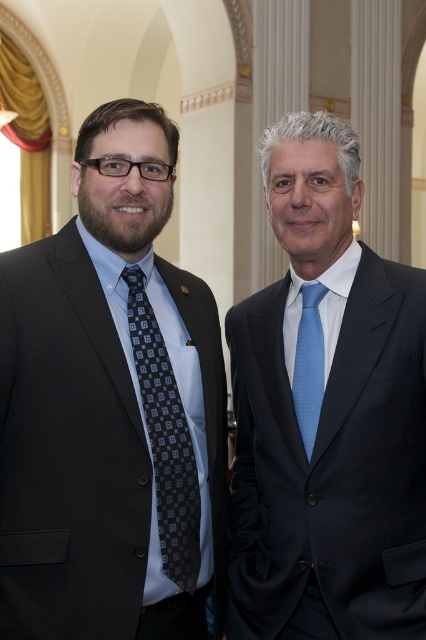
Is matte black suit at left positioned before light blue textured tie at center?

Yes, matte black suit at left is in front of light blue textured tie at center.

Is matte black suit at left to the left of light blue textured tie at center from the viewer's perspective?

Yes, matte black suit at left is to the left of light blue textured tie at center.

Who is more distant from viewer, [32,381] or [310,452]?

Point [310,452]

Where is `matte black suit at left`? The height and width of the screenshot is (640, 426). matte black suit at left is located at coordinates (111, 410).

Is matte black suit at left thinner than matte black suit at center?

No.

Between point (175, 477) and point (293, 262), which one is positioned in front?

Point (175, 477) is more forward.

Between point (210, 442) and point (322, 424), which one is positioned behind?

Point (210, 442)

This screenshot has width=426, height=640. Find the location of `matte black suit at left`. matte black suit at left is located at coordinates (111, 410).

Does dark gray textured tie at left have a greater height compared to light blue textured tie at center?

Correct, dark gray textured tie at left is much taller as light blue textured tie at center.

Is dark gray textured tie at left closer to the viewer compared to light blue textured tie at center?

Yes, dark gray textured tie at left is in front of light blue textured tie at center.

Measure the distance between dark gray textured tie at left and camera.

dark gray textured tie at left is 10.95 meters away from camera.

Locate an element on the screen. Image resolution: width=426 pixels, height=640 pixels. dark gray textured tie at left is located at coordinates (166, 440).